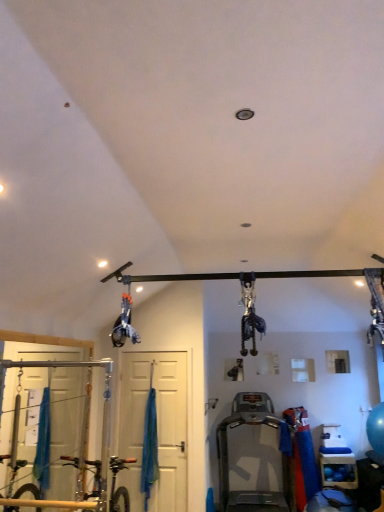
Question: Should I look upward or downward to see silver metallic treadmill at center?

Choices:
 (A) up
 (B) down

Answer: (B)

Question: Is silver metallic treadmill at center aimed at blue rubber balls at lower right?

Choices:
 (A) yes
 (B) no

Answer: (B)

Question: Is blue rubber balls at lower right a part of silver metallic treadmill at center?

Choices:
 (A) yes
 (B) no

Answer: (B)

Question: Is silver metallic treadmill at center far from blue rubber balls at lower right?

Choices:
 (A) yes
 (B) no

Answer: (B)

Question: From a real-world perspective, is silver metallic treadmill at center positioned under blue rubber balls at lower right based on gravity?

Choices:
 (A) no
 (B) yes

Answer: (A)

Question: Can you confirm if silver metallic treadmill at center is bigger than blue rubber balls at lower right?

Choices:
 (A) yes
 (B) no

Answer: (A)

Question: From the image's perspective, is silver metallic treadmill at center over blue rubber balls at lower right?

Choices:
 (A) yes
 (B) no

Answer: (A)

Question: Is silver metallic treadmill at center behind white matte door at center?

Choices:
 (A) no
 (B) yes

Answer: (A)

Question: Is silver metallic treadmill at center in front of white matte door at center?

Choices:
 (A) yes
 (B) no

Answer: (A)

Question: From the image's perspective, is silver metallic treadmill at center located beneath white matte door at center?

Choices:
 (A) yes
 (B) no

Answer: (A)

Question: From a real-world perspective, is silver metallic treadmill at center located beneath white matte door at center?

Choices:
 (A) yes
 (B) no

Answer: (A)

Question: Considering the relative sizes of silver metallic treadmill at center and white matte door at center in the image provided, is silver metallic treadmill at center shorter than white matte door at center?

Choices:
 (A) no
 (B) yes

Answer: (B)

Question: Is silver metallic treadmill at center not within white matte door at center?

Choices:
 (A) yes
 (B) no

Answer: (A)

Question: Is white matte door at center completely or partially outside of silver metallic treadmill at center?

Choices:
 (A) no
 (B) yes

Answer: (B)